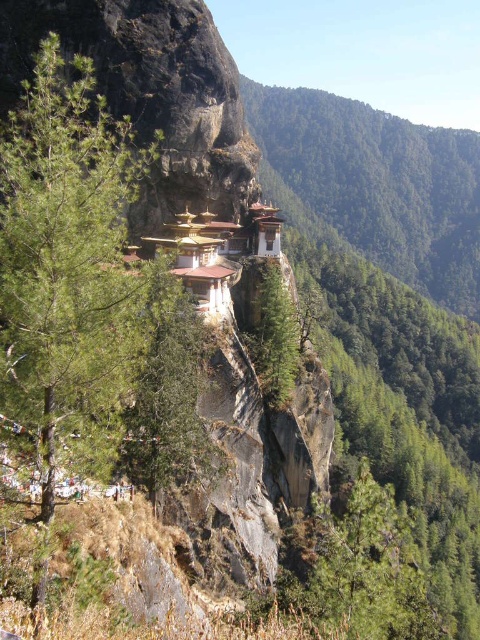
Question: Is green leafy tree at center wider than green rough bark tree at center?

Choices:
 (A) yes
 (B) no

Answer: (A)

Question: Among these objects, which one is farthest from the camera?

Choices:
 (A) green rough bark tree at center
 (B) green leafy tree at center

Answer: (B)

Question: Is green leafy tree at center thinner than green rough bark tree at center?

Choices:
 (A) yes
 (B) no

Answer: (B)

Question: Is green leafy tree at center closer to camera compared to green rough bark tree at center?

Choices:
 (A) no
 (B) yes

Answer: (A)